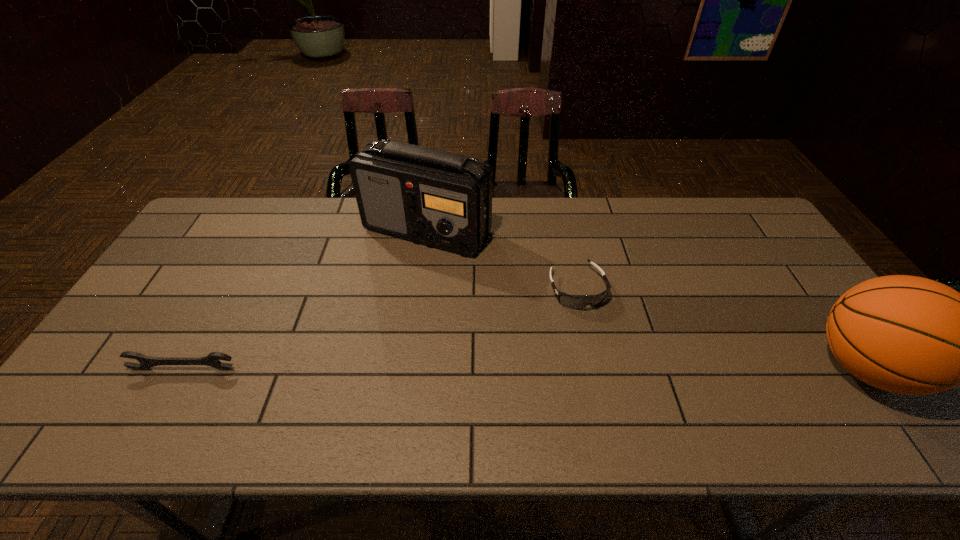
Identify the location of free space located on the front panel of the radio receiver. The image size is (960, 540). (433, 275).

You are a GUI agent. You are given a task and a screenshot of the screen. Output one action in this format:
    pyautogui.click(x=<x>, y=<y>)
    Task: Click on the vacant space located 0.100m on the front panel of the radio receiver
    The width and height of the screenshot is (960, 540).
    Given the screenshot: What is the action you would take?
    pyautogui.click(x=434, y=282)

Identify the location of object located at the far edge. (437, 198).

Where is `object that is at the near edge`? object that is at the near edge is located at coordinates (213, 359).

At what (x,y) coordinates should I click in order to perform the action: click on object situated at the left edge. Please return your answer as a coordinate pair (x, y). Looking at the image, I should click on (213, 359).

Find the location of a particular element. object that is at the near left corner is located at coordinates (213, 359).

Identify the location of vacant space at the far edge of the desktop. This screenshot has width=960, height=540. (602, 210).

In the image, there is a desktop. In order to click on vacant space at the near edge in this screenshot , I will do `click(799, 393)`.

Find the location of a particular element. This screenshot has width=960, height=540. free spot at the left edge of the desktop is located at coordinates (143, 324).

Locate an element on the screen. This screenshot has width=960, height=540. vacant region at the far left corner of the desktop is located at coordinates (241, 198).